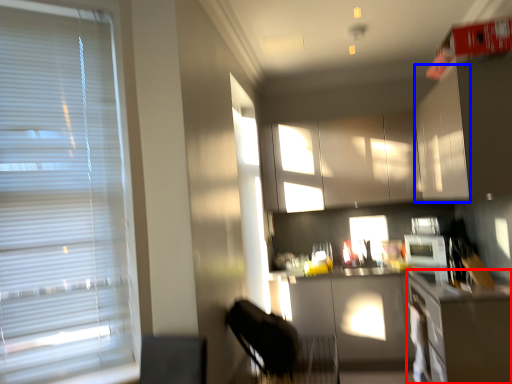
Question: Which object appears closest to the camera in this image, counter top (highlighted by a red box) or cabinetry (highlighted by a blue box)?

Choices:
 (A) counter top
 (B) cabinetry

Answer: (A)